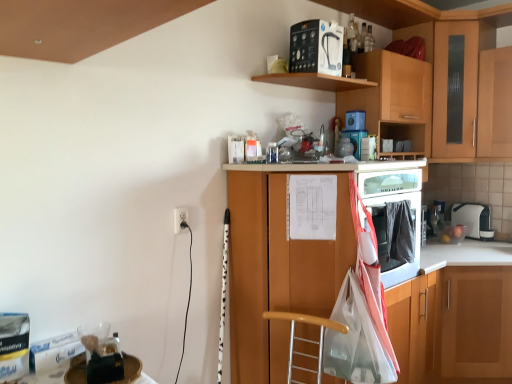
Question: Is wooden cabinet at right, which ranks as the 3th cabinetry in left-to-right order, turned away from wooden cabinet at center, positioned as the 1th cabinetry in left-to-right order?

Choices:
 (A) no
 (B) yes

Answer: (A)

Question: From the image's perspective, would you say wooden cabinet at right, which ranks as the 3th cabinetry in left-to-right order, is shown under wooden cabinet at center, positioned as the 1th cabinetry in left-to-right order?

Choices:
 (A) no
 (B) yes

Answer: (B)

Question: Is wooden cabinet at right, the second cabinetry in the right-to-left sequence, facing towards wooden cabinet at center, the fourth cabinetry in the right-to-left sequence?

Choices:
 (A) yes
 (B) no

Answer: (B)

Question: Considering the relative sizes of wooden cabinet at right, the second cabinetry in the right-to-left sequence, and wooden cabinet at center, the fourth cabinetry in the right-to-left sequence, in the image provided, is wooden cabinet at right, the second cabinetry in the right-to-left sequence, smaller than wooden cabinet at center, the fourth cabinetry in the right-to-left sequence,?

Choices:
 (A) no
 (B) yes

Answer: (B)

Question: Is the position of wooden cabinet at right, which ranks as the 3th cabinetry in left-to-right order, less distant than that of wooden cabinet at center, the fourth cabinetry in the right-to-left sequence?

Choices:
 (A) yes
 (B) no

Answer: (B)

Question: Is wooden cabinet at right, the second cabinetry in the right-to-left sequence, far from wooden cabinet at center, positioned as the 1th cabinetry in left-to-right order?

Choices:
 (A) no
 (B) yes

Answer: (A)

Question: Is white glossy counter at lower right located outside white plastic toaster at upper right, the 1th appliance when ordered from back to front?

Choices:
 (A) no
 (B) yes

Answer: (B)

Question: Is white plastic toaster at upper right, positioned as the 4th appliance in left-to-right order, located within white glossy counter at lower right?

Choices:
 (A) no
 (B) yes

Answer: (A)

Question: Considering the relative sizes of white glossy counter at lower right and white plastic toaster at upper right, which appears as the first appliance when viewed from the right, in the image provided, is white glossy counter at lower right taller than white plastic toaster at upper right, which appears as the first appliance when viewed from the right,?

Choices:
 (A) no
 (B) yes

Answer: (B)

Question: From the image's perspective, is white glossy counter at lower right below white plastic toaster at upper right, acting as the fourth appliance starting from the top?

Choices:
 (A) no
 (B) yes

Answer: (B)

Question: Is white glossy counter at lower right not near white plastic toaster at upper right, which appears as the first appliance when viewed from the right?

Choices:
 (A) no
 (B) yes

Answer: (A)

Question: From a real-world perspective, is white glossy counter at lower right under white plastic toaster at upper right, which is counted as the first appliance, starting from the bottom?

Choices:
 (A) yes
 (B) no

Answer: (A)

Question: Is blue plastic container at upper center, which ranks as the 2th appliance in back-to-front order, taller than white plastic toaster at upper right, the 1th appliance when ordered from back to front?

Choices:
 (A) no
 (B) yes

Answer: (A)